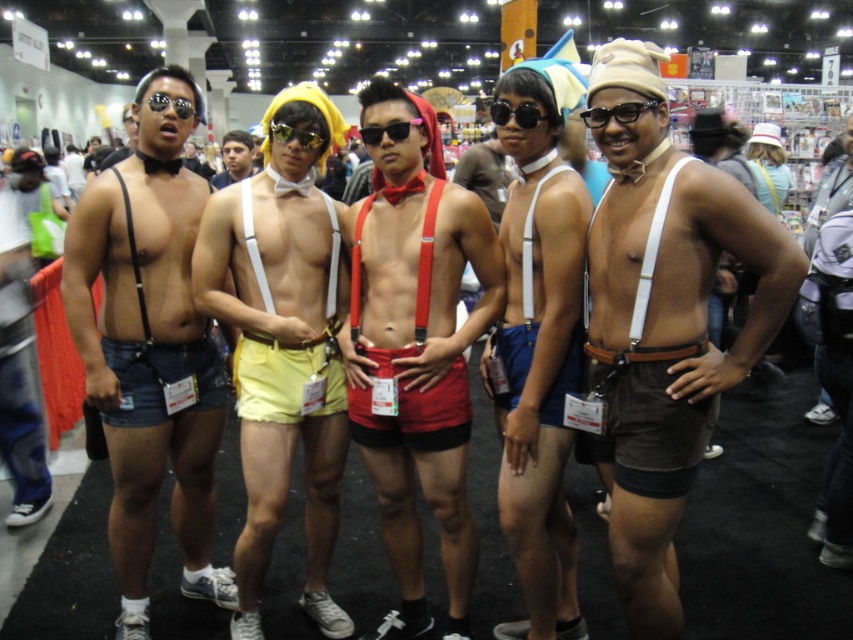
Question: Among these objects, which one is farthest from the camera?

Choices:
 (A) matte black goggles at center
 (B) red matte suspenders at center

Answer: (A)

Question: Can you confirm if denim shorts at left is smaller than matte black goggles at center?

Choices:
 (A) yes
 (B) no

Answer: (B)

Question: Among these points, which one is farthest from the camera?

Choices:
 (A) (218, 173)
 (B) (146, 150)

Answer: (A)

Question: Is brown suede shorts at center behind denim shorts at center?

Choices:
 (A) yes
 (B) no

Answer: (B)

Question: Among these points, which one is nearest to the camera?

Choices:
 (A) (280, 140)
 (B) (525, 544)

Answer: (B)

Question: In this image, where is red matte suspenders at center located relative to yellow fabric shorts at center?

Choices:
 (A) below
 (B) above

Answer: (A)